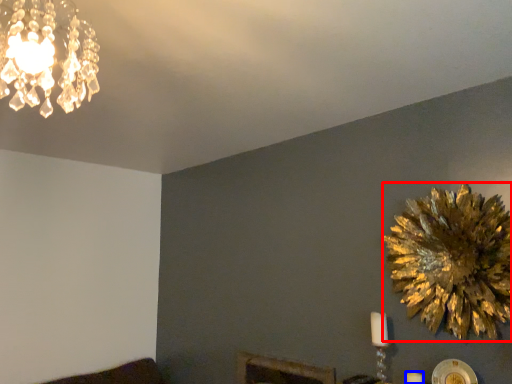
Question: Which object appears farthest to the camera in this image, flower (highlighted by a red box) or candle (highlighted by a blue box)?

Choices:
 (A) flower
 (B) candle

Answer: (B)